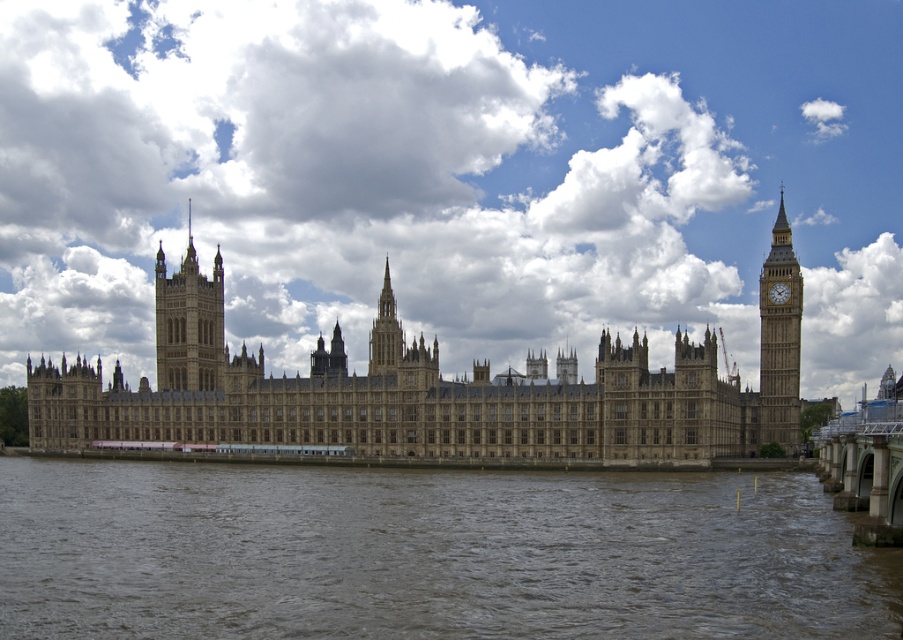
Question: Which object appears closest to the camera in this image?

Choices:
 (A) golden stone clock tower at right
 (B) brown stone building at center

Answer: (B)

Question: Is brown water at lower left closer to camera compared to metallic gray bridge at lower right?

Choices:
 (A) yes
 (B) no

Answer: (A)

Question: Among these objects, which one is nearest to the camera?

Choices:
 (A) metallic gray bridge at lower right
 (B) golden stone palace at center
 (C) golden stone tower at left

Answer: (A)

Question: Does golden stone palace at center appear over golden stone clock tower at right?

Choices:
 (A) no
 (B) yes

Answer: (A)

Question: Is brown water at lower left to the left of gold metallic clock at upper right from the viewer's perspective?

Choices:
 (A) yes
 (B) no

Answer: (A)

Question: Based on their relative distances, which object is farther from the white fluffy cloud at upper center?

Choices:
 (A) golden stone palace at center
 (B) brown stone building at center

Answer: (A)